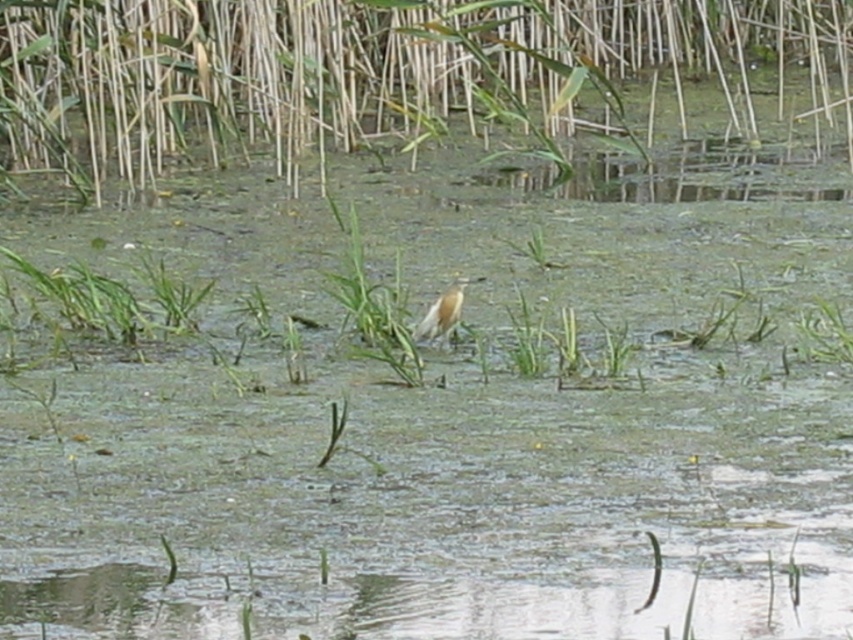
Question: Does green grass at upper center appear on the right side of white matte bird at center?

Choices:
 (A) yes
 (B) no

Answer: (B)

Question: Observing the image, what is the correct spatial positioning of green grass at upper center in reference to white matte bird at center?

Choices:
 (A) right
 (B) left

Answer: (B)

Question: Does green grass at upper center lie behind white matte bird at center?

Choices:
 (A) no
 (B) yes

Answer: (B)